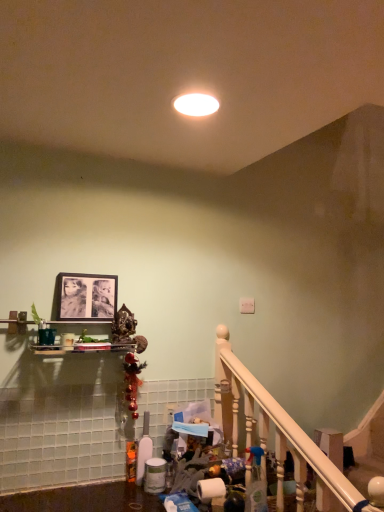
Identify the location of empty space that is ontop of white glossy light fixture at center (from a real-world perspective). The height and width of the screenshot is (512, 384). (194, 110).